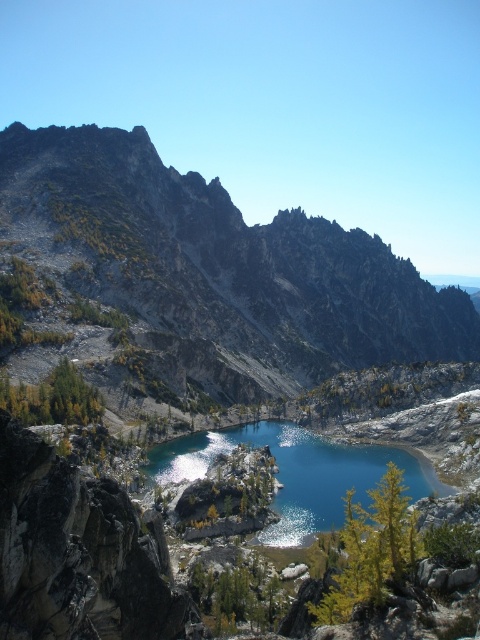
Question: Observing the image, what is the correct spatial positioning of rugged gray rock formation at center in reference to teal glossy water at center?

Choices:
 (A) above
 (B) below

Answer: (A)

Question: Observing the image, what is the correct spatial positioning of rugged gray rock formation at center in reference to teal glossy water at center?

Choices:
 (A) left
 (B) right

Answer: (B)

Question: Does rugged gray rock formation at center have a larger size compared to teal glossy water at center?

Choices:
 (A) no
 (B) yes

Answer: (B)